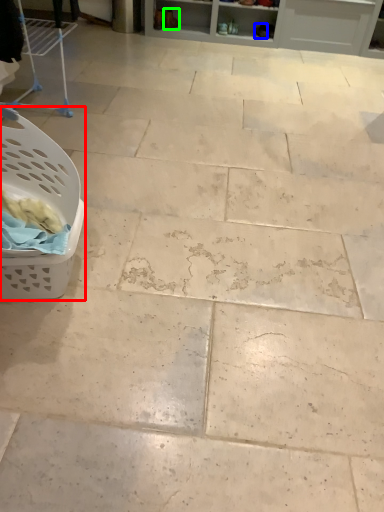
Question: Which object is positioned closest to basket (highlighted by a red box)? Select from footwear (highlighted by a blue box) and footwear (highlighted by a green box).

Choices:
 (A) footwear
 (B) footwear

Answer: (B)